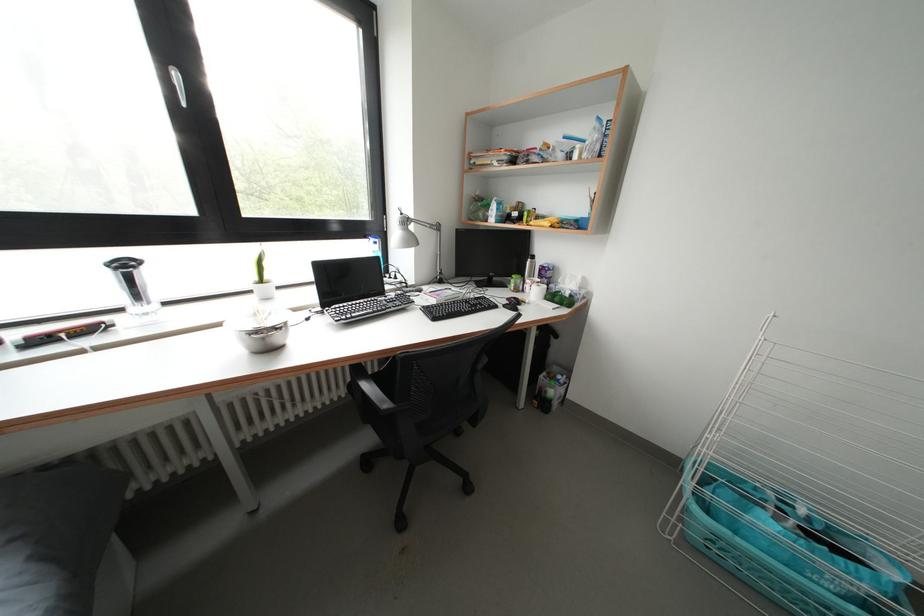
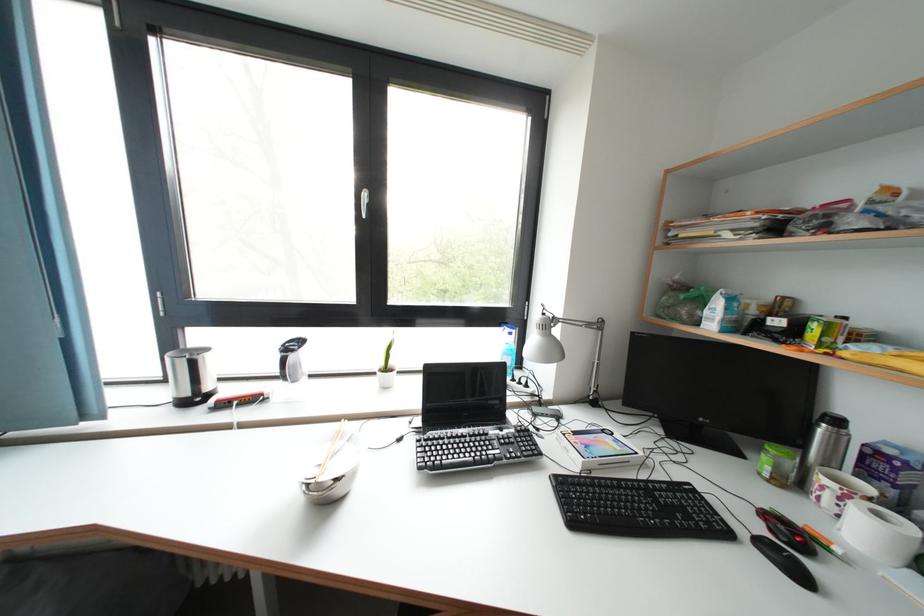
Question: The images are taken continuously from a first-person perspective. In which direction is your viewpoint rotating?

Choices:
 (A) Left
 (B) Right
 (C) Up
 (D) Down

Answer: (A)